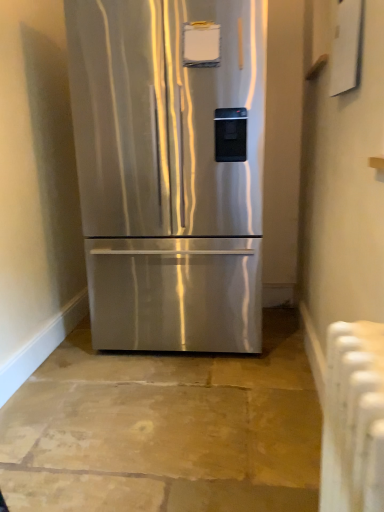
This screenshot has width=384, height=512. I want to click on white plastic radiator at lower right, so click(x=353, y=419).

This screenshot has width=384, height=512. What do you see at coordinates (353, 419) in the screenshot?
I see `white plastic radiator at lower right` at bounding box center [353, 419].

You are a GUI agent. You are given a task and a screenshot of the screen. Output one action in this format:
    pyautogui.click(x=<x>, y=<y>)
    Task: Click on the stainless steel refrigerator at center
    
    Given the screenshot: What is the action you would take?
    pyautogui.click(x=170, y=169)

Measure the distance between stainless steel refrigerator at center and camera.

stainless steel refrigerator at center and camera are 5.87 feet apart.

Measure the distance between point (67,38) and camera.

Point (67,38) and camera are 2.57 meters apart from each other.

What do you see at coordinates (170, 169) in the screenshot?
I see `stainless steel refrigerator at center` at bounding box center [170, 169].

The image size is (384, 512). I want to click on white plastic radiator at lower right, so click(353, 419).

Is stainless steel refrigerator at center to the right of white plastic radiator at lower right from the viewer's perspective?

Incorrect, stainless steel refrigerator at center is not on the right side of white plastic radiator at lower right.

Who is more distant, stainless steel refrigerator at center or white plastic radiator at lower right?

stainless steel refrigerator at center is behind.

Is point (260, 115) positioned before point (340, 493)?

No, it is behind (340, 493).

From the image's perspective, between stainless steel refrigerator at center and white plastic radiator at lower right, which one is located above?

stainless steel refrigerator at center is shown above in the image.

From a real-world perspective, which is physically below, stainless steel refrigerator at center or white plastic radiator at lower right?

In real-world perspective, white plastic radiator at lower right is lower.

Does stainless steel refrigerator at center have a greater width compared to white plastic radiator at lower right?

Yes, stainless steel refrigerator at center is wider than white plastic radiator at lower right.

Consider the image. Which of these two, stainless steel refrigerator at center or white plastic radiator at lower right, stands shorter?

Standing shorter between the two is white plastic radiator at lower right.

Is stainless steel refrigerator at center bigger than white plastic radiator at lower right?

Yes, stainless steel refrigerator at center is bigger than white plastic radiator at lower right.

Is stainless steel refrigerator at center inside the boundaries of white plastic radiator at lower right, or outside?

stainless steel refrigerator at center is spatially situated outside white plastic radiator at lower right.

Can you see stainless steel refrigerator at center touching white plastic radiator at lower right?

There is a gap between stainless steel refrigerator at center and white plastic radiator at lower right.

Is stainless steel refrigerator at center oriented away from white plastic radiator at lower right?

No, white plastic radiator at lower right is not at the back of stainless steel refrigerator at center.

At what (x,y) coordinates should I click in order to perform the action: click on radiator below the stainless steel refrigerator at center (from a real-world perspective). Please return your answer as a coordinate pair (x, y). This screenshot has height=512, width=384. Looking at the image, I should click on (353, 419).

Is white plastic radiator at lower right to the right of stainless steel refrigerator at center from the viewer's perspective?

Yes.

Relative to stainless steel refrigerator at center, is white plastic radiator at lower right in front or behind?

In the image, white plastic radiator at lower right appears in front of stainless steel refrigerator at center.

Which point is more distant from viewer, [332,480] or [77,86]?

Point [77,86]

From the image's perspective, relative to stainless steel refrigerator at center, is white plastic radiator at lower right above or below?

From the image's perspective, white plastic radiator at lower right appears below stainless steel refrigerator at center.

From a real-world perspective, which object rests below the other?

In real-world perspective, white plastic radiator at lower right is lower.

Is white plastic radiator at lower right wider than stainless steel refrigerator at center?

No.

Considering the sizes of objects white plastic radiator at lower right and stainless steel refrigerator at center in the image provided, who is shorter, white plastic radiator at lower right or stainless steel refrigerator at center?

With less height is white plastic radiator at lower right.

Does white plastic radiator at lower right have a smaller size compared to stainless steel refrigerator at center?

Indeed, white plastic radiator at lower right has a smaller size compared to stainless steel refrigerator at center.

Based on the photo, is white plastic radiator at lower right outside of stainless steel refrigerator at center?

white plastic radiator at lower right is positioned outside stainless steel refrigerator at center.

Would you say white plastic radiator at lower right is a long distance from stainless steel refrigerator at center?

Yes, white plastic radiator at lower right and stainless steel refrigerator at center are located far from each other.

Is white plastic radiator at lower right oriented away from stainless steel refrigerator at center?

No, white plastic radiator at lower right is not facing away from stainless steel refrigerator at center.

How distant is white plastic radiator at lower right from stainless steel refrigerator at center?

white plastic radiator at lower right and stainless steel refrigerator at center are 1.39 meters apart.

Find the location of a particular element. This screenshot has width=384, height=512. refrigerator above the white plastic radiator at lower right (from the image's perspective) is located at coordinates (170, 169).

This screenshot has width=384, height=512. Find the location of `refrigerator above the white plastic radiator at lower right (from a real-world perspective)`. refrigerator above the white plastic radiator at lower right (from a real-world perspective) is located at coordinates (170, 169).

Identify the location of refrigerator located behind the white plastic radiator at lower right. This screenshot has height=512, width=384. (170, 169).